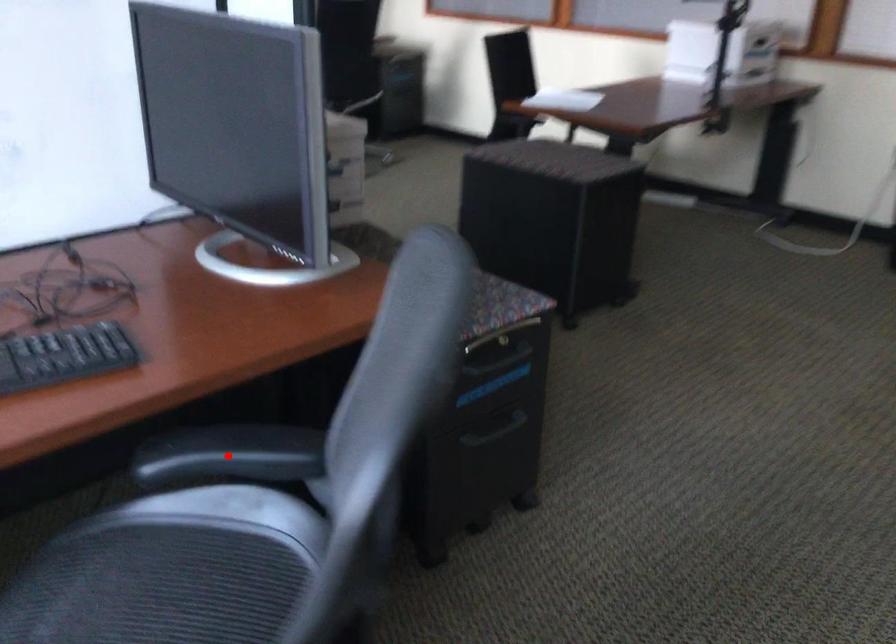
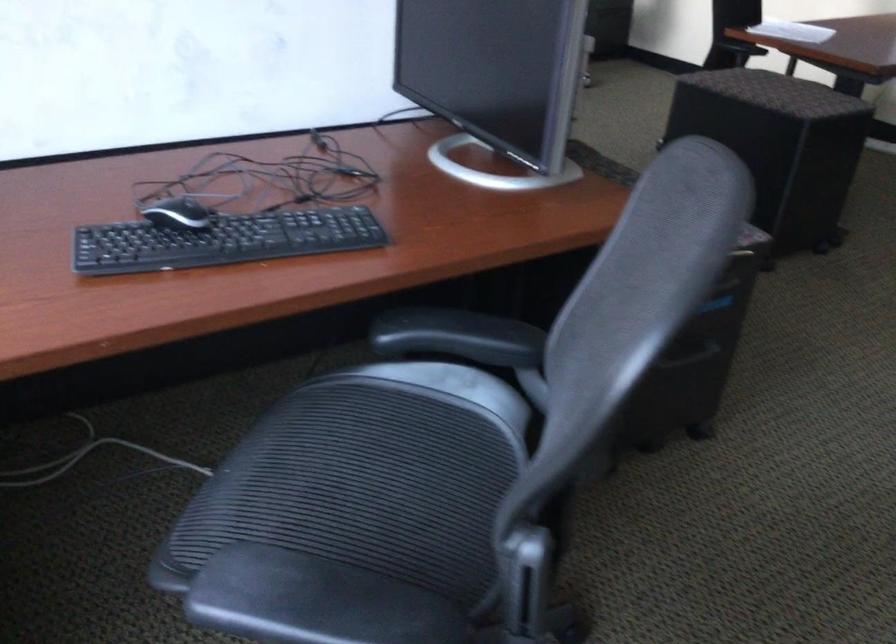
Where in the second image is the point corresponding to the highlighted location from the first image?

(458, 337)